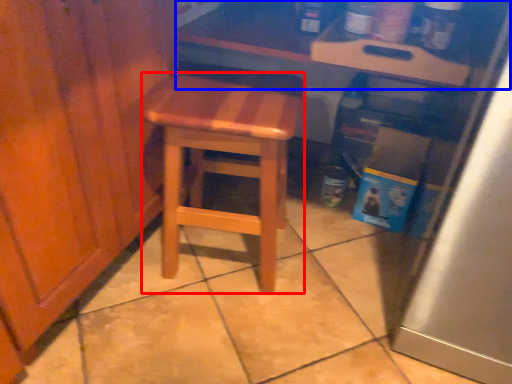
Question: Which object appears closest to the camera in this image, stool (highlighted by a red box) or counter (highlighted by a blue box)?

Choices:
 (A) stool
 (B) counter

Answer: (A)